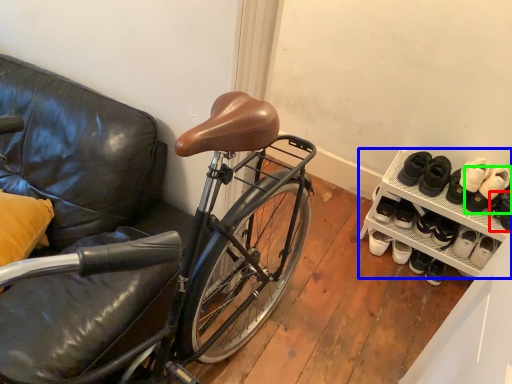
Question: Considering the real-world distances, which object is farthest from shoe (highlighted by a red box)? cabinetry (highlighted by a blue box) or footwear (highlighted by a green box)?

Choices:
 (A) cabinetry
 (B) footwear

Answer: (A)